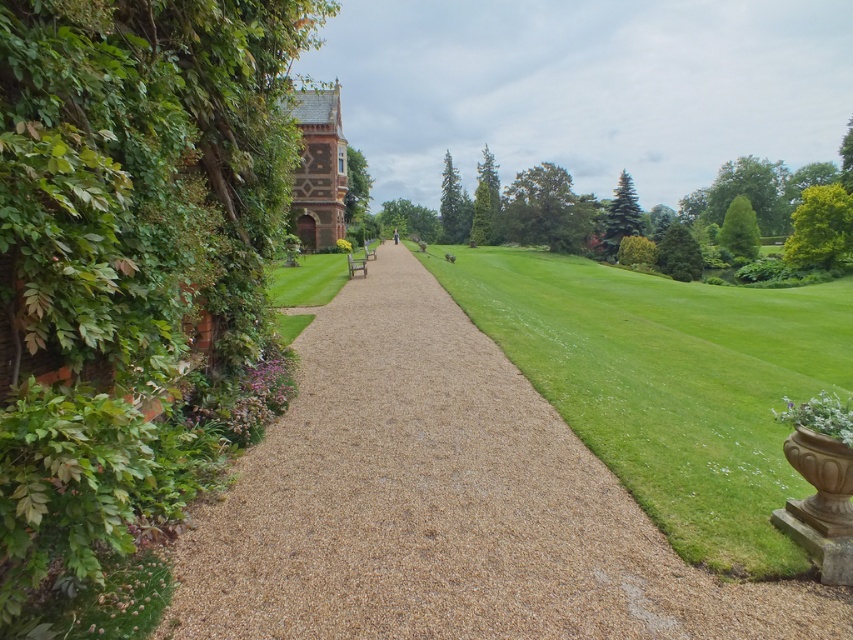
Question: Is green leafy hedge at left behind green leafy hedge at right?

Choices:
 (A) no
 (B) yes

Answer: (A)

Question: Which point is farther from the camera taking this photo?

Choices:
 (A) (689, 454)
 (B) (28, 413)
 (C) (851, 195)

Answer: (C)

Question: Which object is the farthest from the green grass at center?

Choices:
 (A) green leafy hedge at right
 (B) green leafy hedge at left

Answer: (A)

Question: Does green grass at center have a greater width compared to green leafy hedge at right?

Choices:
 (A) no
 (B) yes

Answer: (B)

Question: Which of these objects is positioned farthest from the green leafy hedge at right?

Choices:
 (A) green grass at center
 (B) green leafy hedge at left

Answer: (B)

Question: From the image, what is the correct spatial relationship of green grass at center in relation to green leafy hedge at right?

Choices:
 (A) below
 (B) above

Answer: (A)